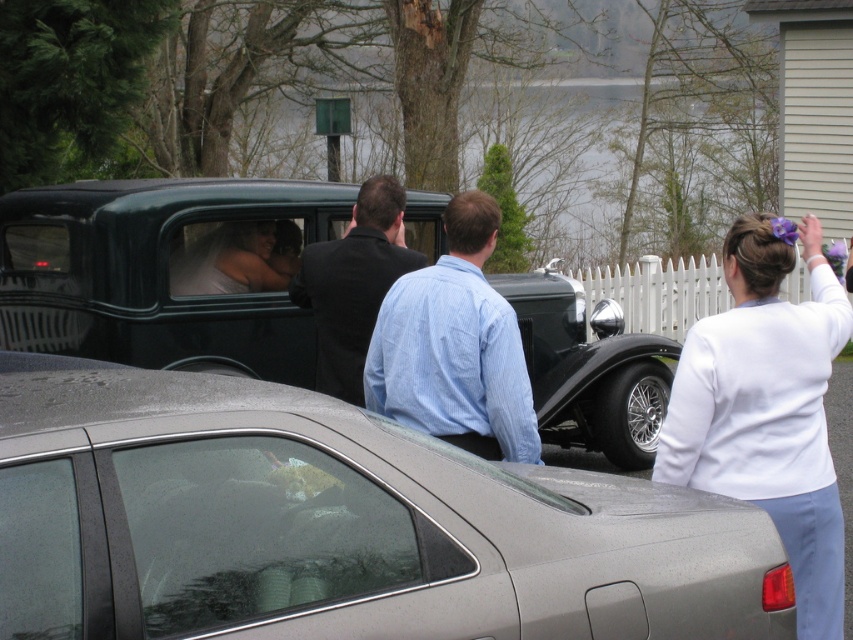
You are a photographer at a wedding event. You need to capture a photo that includes both the white fabric at upper right and the dark suit at center. Based on their positions, which object should you place on the right side of your camera frame to ensure both are visible?

The white fabric at upper right should be placed on the right side of your camera frame because it is already positioned on the right side of the dark suit at center.

You are a photographer setting up for a wedding photo. You have a satin silver car at center and a white fabric at upper right in your frame. Which object is wider in the image?

The satin silver car at center is wider than the white fabric at upper right according to the description.

You are a photographer at a wedding. You need to capture a photo of the blue striped shirt at center and dark suit at center. Which one is closer to the camera?

The blue striped shirt at center is positioned under dark suit at center, so the dark suit at center is closer to the camera.